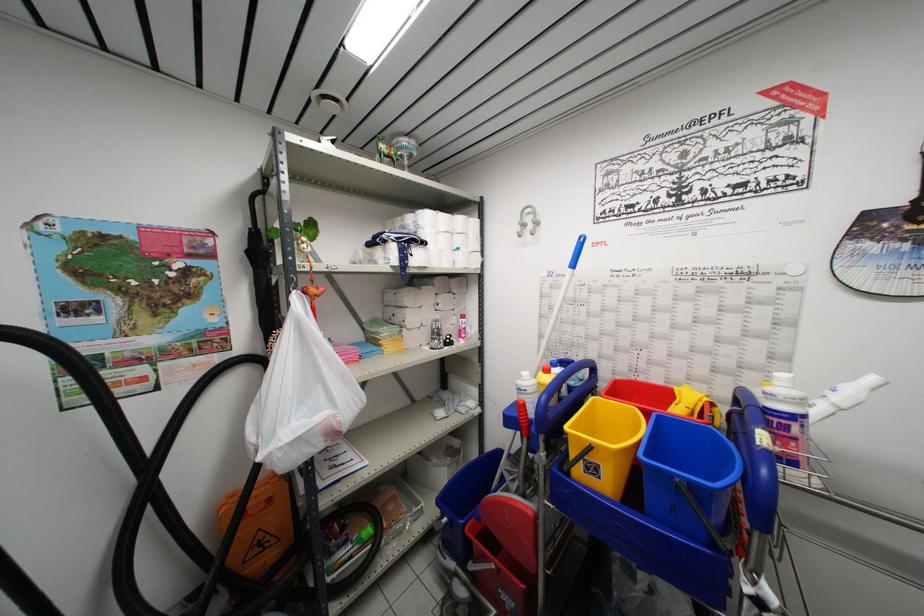
What are the coordinates of `black umbrella handle` in the screenshot? It's located at (261, 281).